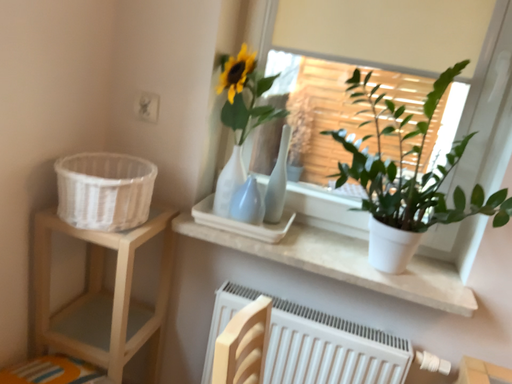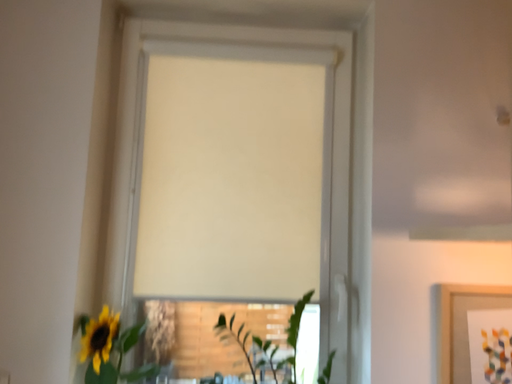
Question: How did the camera likely rotate when shooting the video?

Choices:
 (A) rotated downward
 (B) rotated upward

Answer: (B)